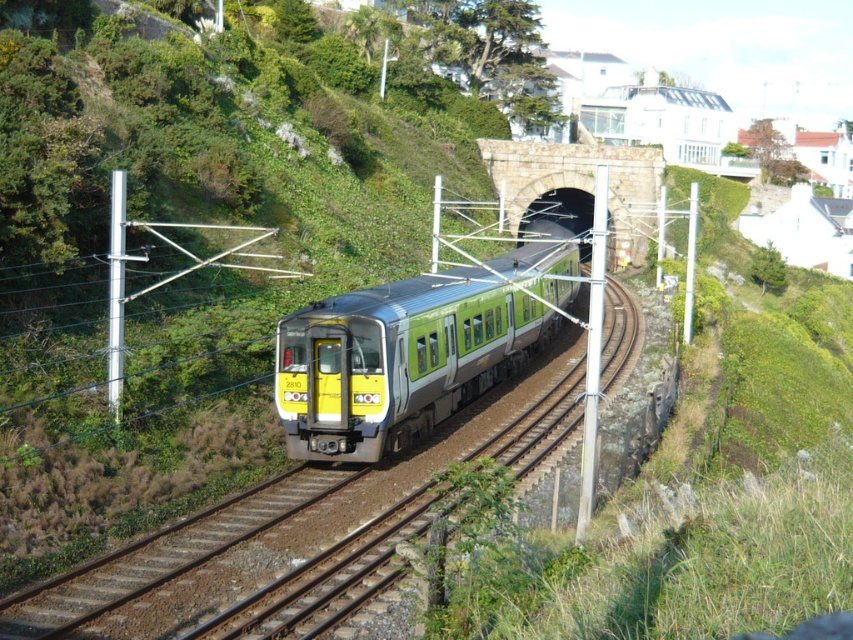
Which is above, green metallic train at center or brown gravel train track at center?

green metallic train at center

Does green metallic train at center appear under brown gravel train track at center?

No.

Find the location of `green metallic train at center`. green metallic train at center is located at coordinates (413, 348).

Is metallic silver track at center above brown gravel train track at center?

Yes.

Does metallic silver track at center have a smaller size compared to brown gravel train track at center?

No, metallic silver track at center is not smaller than brown gravel train track at center.

Is point (364, 490) farther from viewer compared to point (47, 589)?

Yes.

Locate an element on the screen. The width and height of the screenshot is (853, 640). metallic silver track at center is located at coordinates (167, 557).

Measure the distance between green metallic train at center and camera.

They are 67.59 feet apart.

Based on the photo, who is more distant from viewer, (332,433) or (138,540)?

The point (332,433) is behind.

Between point (366, 419) and point (538, 412), which one is positioned behind?

Positioned behind is point (538, 412).

Where is `green metallic train at center`? green metallic train at center is located at coordinates click(x=413, y=348).